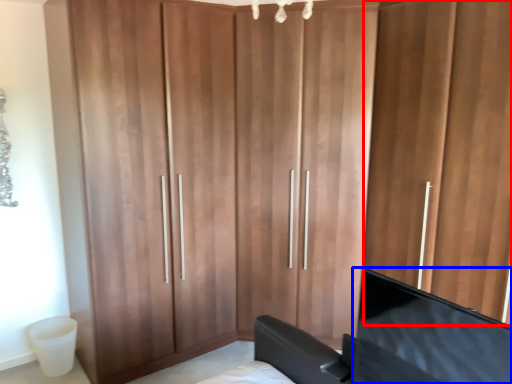
Question: Which of the following is the farthest to the observer, door (highlighted by a red box) or flat (highlighted by a blue box)?

Choices:
 (A) door
 (B) flat

Answer: (A)